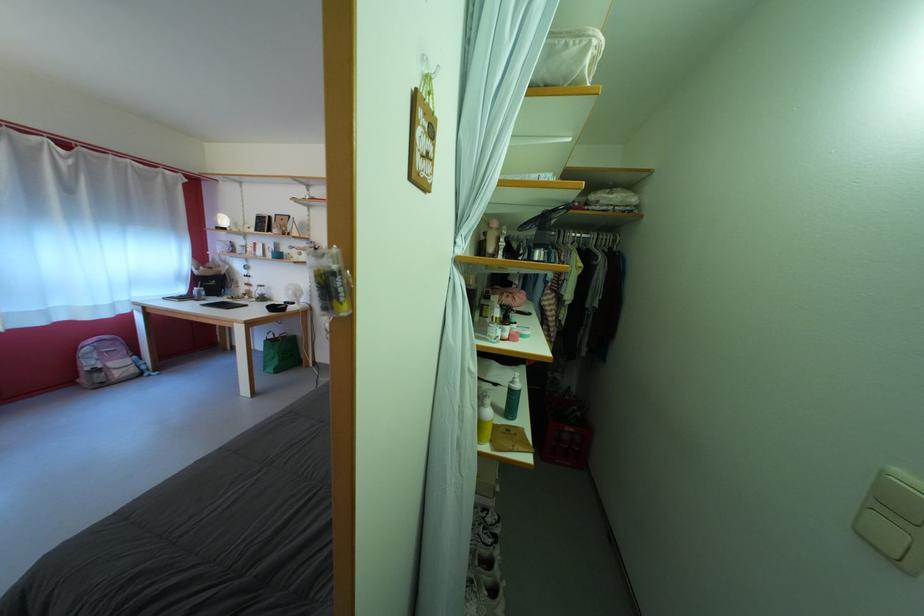
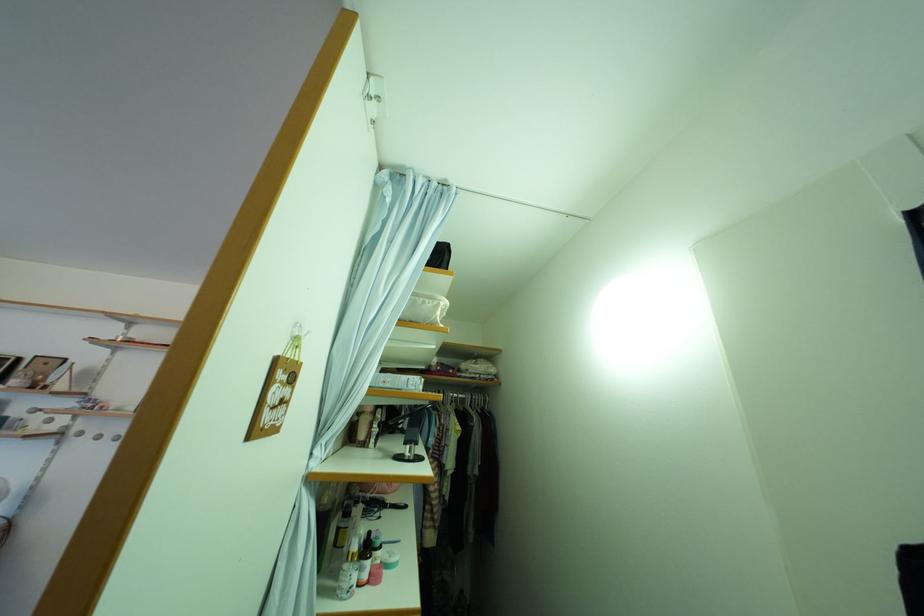
In the second image, find the point that corresponds to (492,244) in the first image.

(363, 424)